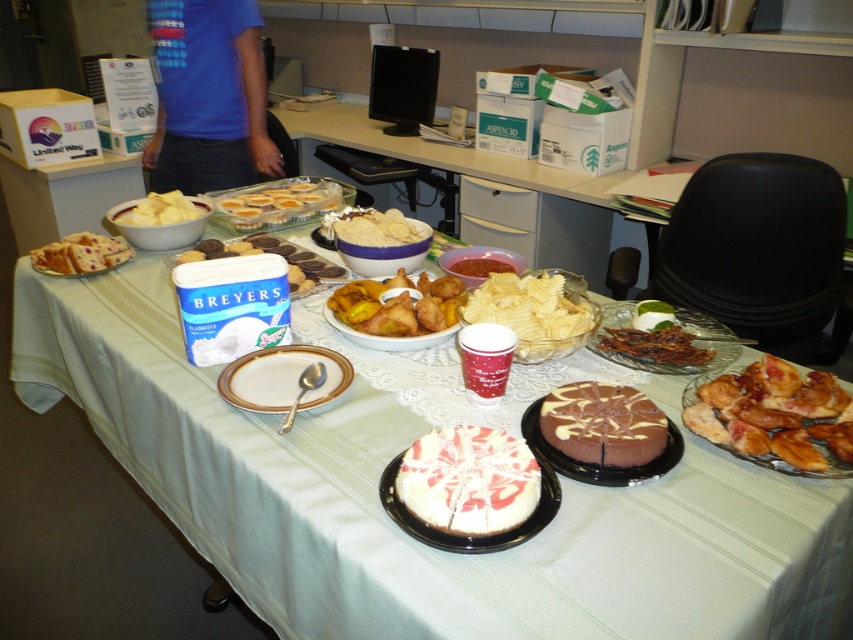
Question: Based on their relative distances, which object is farther from the white ceramic plate at center?

Choices:
 (A) blue ice cream container at center
 (B) translucent glass plate at center
 (C) brown crispy bacon at center
 (D) white matte bowl at upper left

Answer: (D)

Question: Is swirled white cake at center closer to camera compared to matte white cupcakes at center?

Choices:
 (A) no
 (B) yes

Answer: (B)

Question: Can you confirm if white lace tablecloth at center is thinner than wavy brown chips at center?

Choices:
 (A) no
 (B) yes

Answer: (A)

Question: Based on their relative distances, which object is farther from the translucent glass plate at center?

Choices:
 (A) yellow cake at left
 (B) golden crispy chicken at center
 (C) brown crispy bacon at center

Answer: (A)

Question: Can you confirm if translucent glass plate at center is bigger than yellow cake at left?

Choices:
 (A) yes
 (B) no

Answer: (A)

Question: Based on their relative distances, which object is farther from the white ceramic plate at center?

Choices:
 (A) white matte bowl at center
 (B) red matte bowl at center
 (C) swirled white cake at center

Answer: (A)